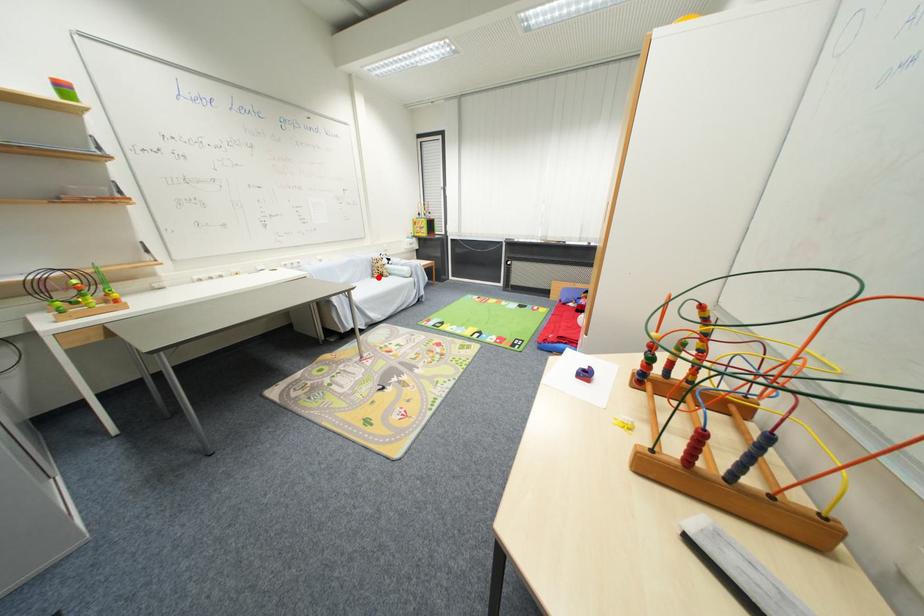
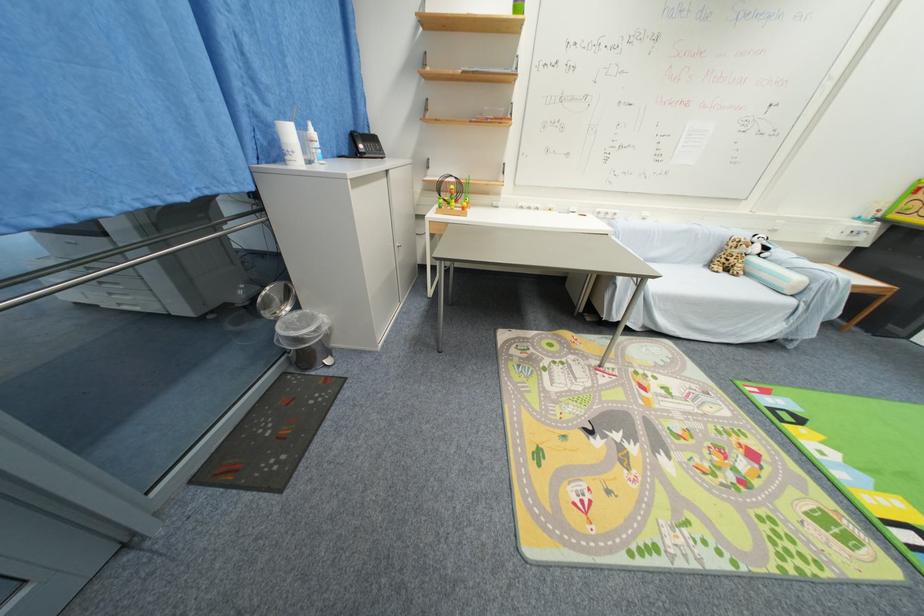
Question: I am providing you with two images of the same scene from different viewpoints. A red point is shown in image1. For the corresponding object point in image2, is it positioned nearer or farther from the camera?

Choices:
 (A) Nearer
 (B) Farther

Answer: (B)